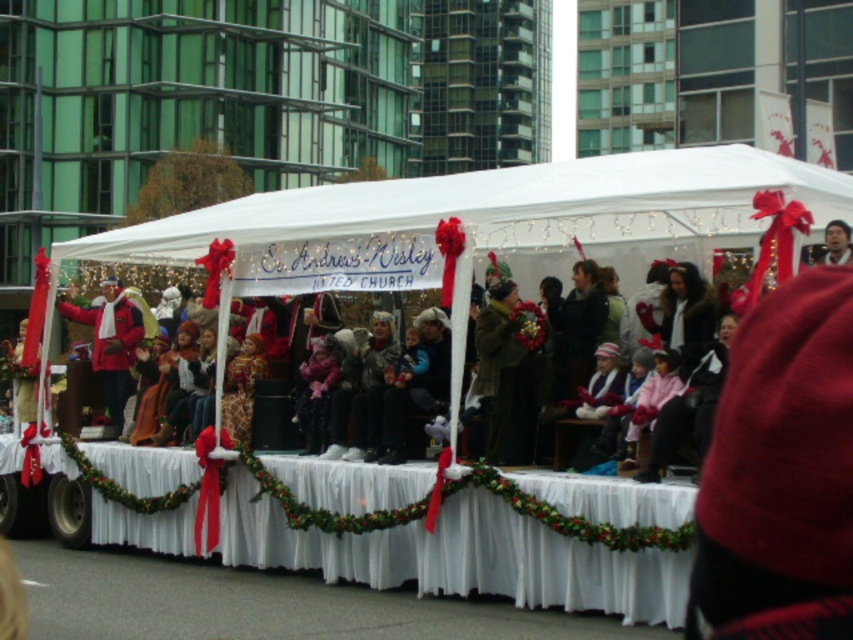
You are a photographer at the parade and want to capture a photo that includes both the red wool coat at left and the smooth brown hair at upper right. Since you need to frame them properly, can you tell me which object is positioned more to the left?

The red wool coat at left is positioned more to the left than the smooth brown hair at upper right.

In the festive parade scene, there is a float labeled St. Andrew s Wesley UNITED CHURCH. The float has a white canopy with red bows and string lights. You see a point marked at coordinates (111, 342). What object is located at that point?

The point at coordinates (111, 342) corresponds to the red wool coat at left.